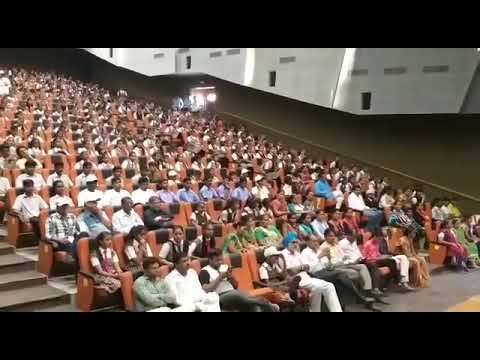
What are the coordinates of `black rectangle above photograph` in the screenshot? It's located at click(x=219, y=28).